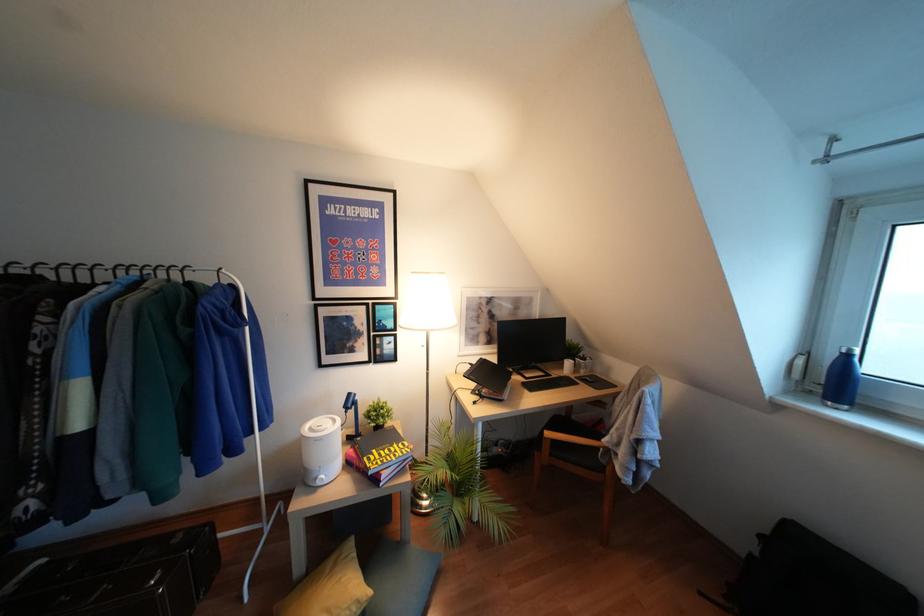
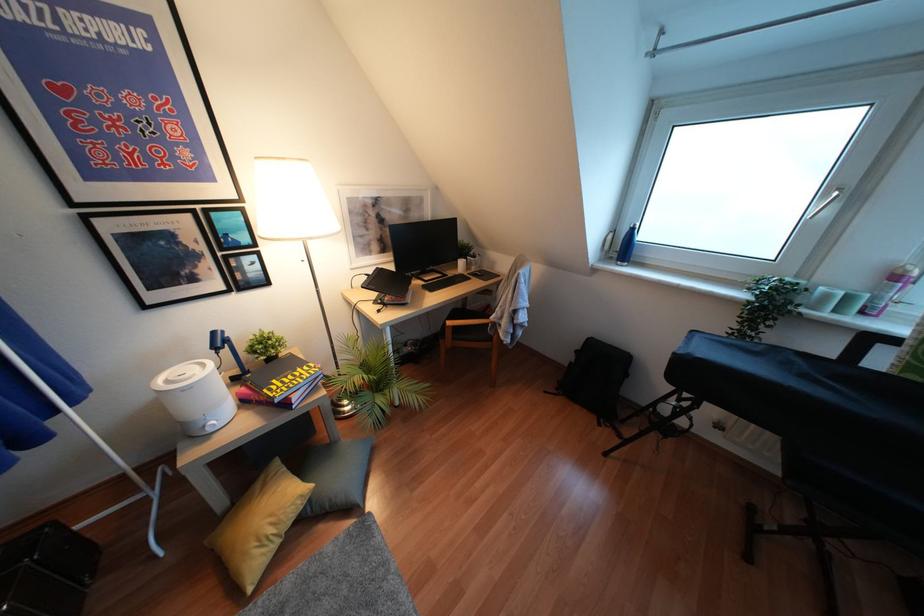
Locate, in the second image, the point that corresponds to the point at 592,381 in the first image.

(481, 274)